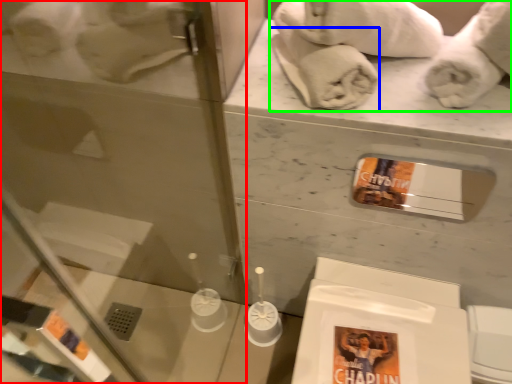
Question: Estimate the real-world distances between objects in this image. Which object is closer to glass door (highlighted by a red box), bath towel (highlighted by a blue box) or bath towel (highlighted by a green box)?

Choices:
 (A) bath towel
 (B) bath towel

Answer: (B)